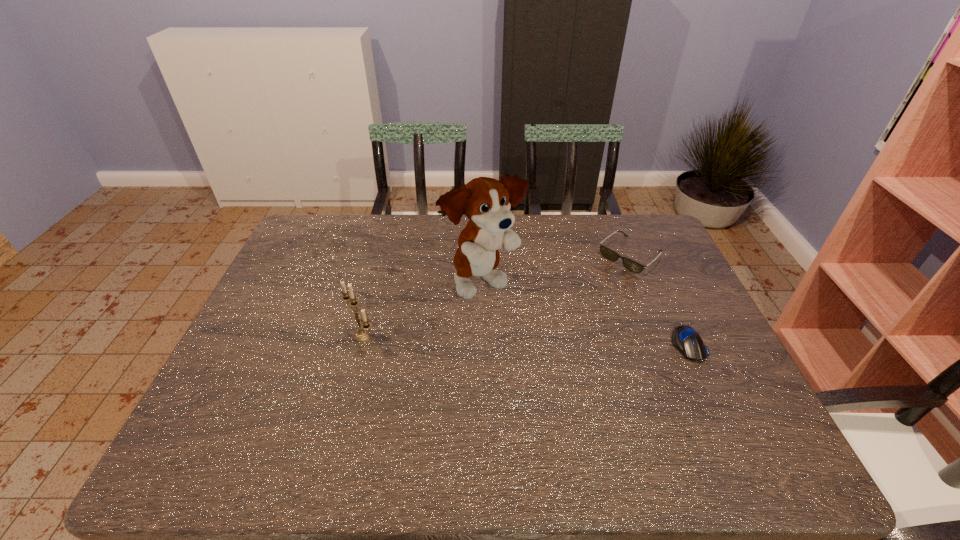
Locate an element on the screen. This screenshot has height=540, width=960. candle is located at coordinates (362, 334).

Locate an element on the screen. the third shortest object is located at coordinates (362, 334).

Locate an element on the screen. This screenshot has width=960, height=540. computer mouse is located at coordinates (685, 339).

The image size is (960, 540). I want to click on sunglasses, so pos(606,252).

Locate an element on the screen. the tallest object is located at coordinates (486, 202).

At what (x,y) coordinates should I click in order to perform the action: click on the third object from right to left. Please return your answer as a coordinate pair (x, y). Looking at the image, I should click on (486, 202).

I want to click on free location located 0.160m on the left of the third shortest object, so click(283, 336).

Image resolution: width=960 pixels, height=540 pixels. I want to click on vacant area situated 0.110m on the button side of the computer mouse, so click(714, 402).

Image resolution: width=960 pixels, height=540 pixels. What are the coordinates of `free space located 0.310m on the front-facing side of the second shortest object` in the screenshot? It's located at (551, 323).

The width and height of the screenshot is (960, 540). I want to click on vacant space located on the front-facing side of the second shortest object, so click(x=591, y=289).